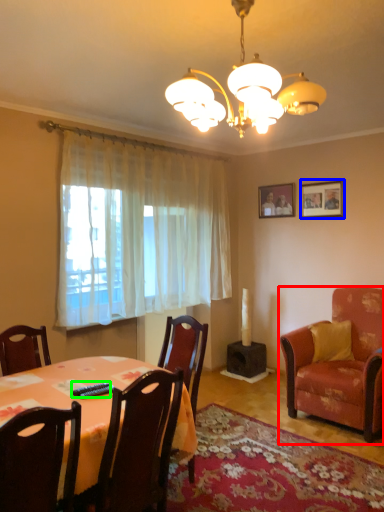
Question: Based on their relative distances, which object is farther from chair (highlighted by a red box)? Choose from picture frame (highlighted by a blue box) and remote control (highlighted by a green box).

Choices:
 (A) picture frame
 (B) remote control

Answer: (B)